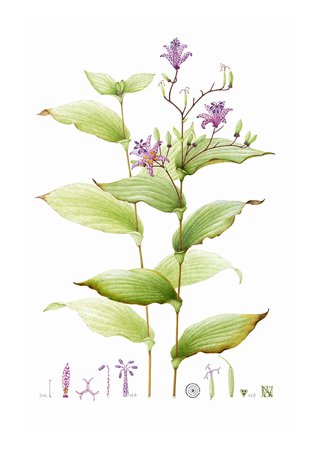
What are the coordinates of `plants in the center` in the screenshot? It's located at (178, 265), (143, 252).